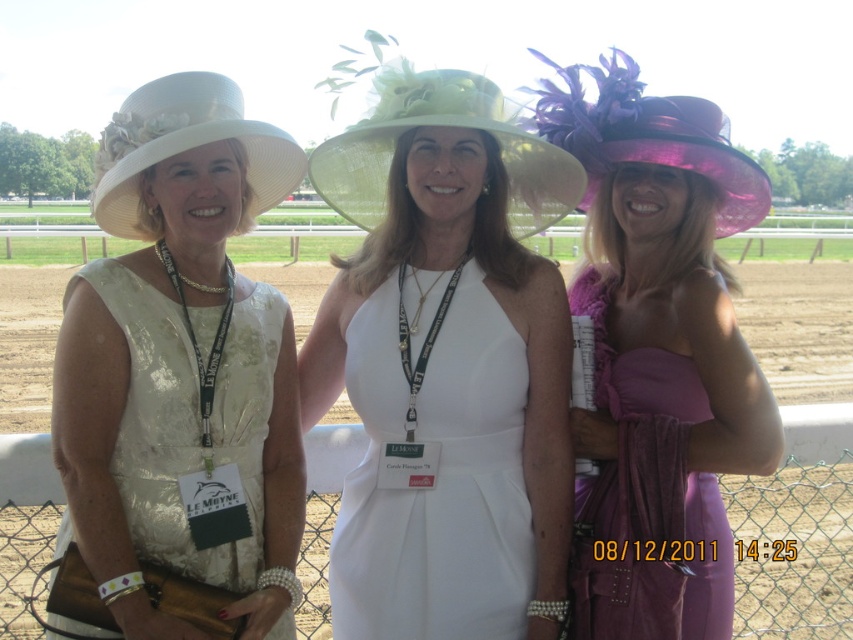
You are a photographer at the horse racing event. You need to capture a photo of the white satin dress at center and light green straw hat at center. Can you tell me which one is located below the other?

The white satin dress at center is positioned under the light green straw hat at center, so the dress is below the hat.